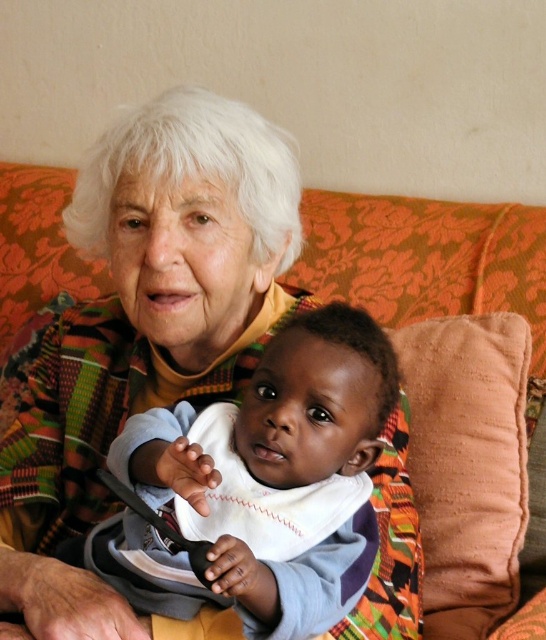
You are a photographer setting up for a family portrait. You need to position the white soft bib at center and the orange floral fabric couch at center such that the bib is visible in the frame. Based on their positions, which object should you focus on first to ensure both are in the shot?

You should focus on the orange floral fabric couch at center first because the white soft bib at center is to the left of it, so adjusting the frame to include the couch will naturally include the bib as well.

You are a photographer setting up a photo shoot in the living room. You have a white soft bib at center and an orange floral fabric couch at center. You want to place a small prop between them so it is visible in the final shot. Based on their positions, where should you place the prop to ensure it is not hidden by either object?

The white soft bib at center is positioned under the orange floral fabric couch at center. To ensure the prop is visible and not hidden, place it above the white soft bib at center, below the orange floral fabric couch at center, or between them where neither object obstructs the view.

You are standing in front of the couch where the elderly woman and the child are sitting. There are two points marked on the couch. The first point is at coordinates point (310,392) and the second point is at point (442,314). If you were to walk towards the couch from the front, which point would you encounter first?

The point at (310,392) is in front of the point at (442,314), so you would encounter the point at (310,392) first when approaching the couch from the front.